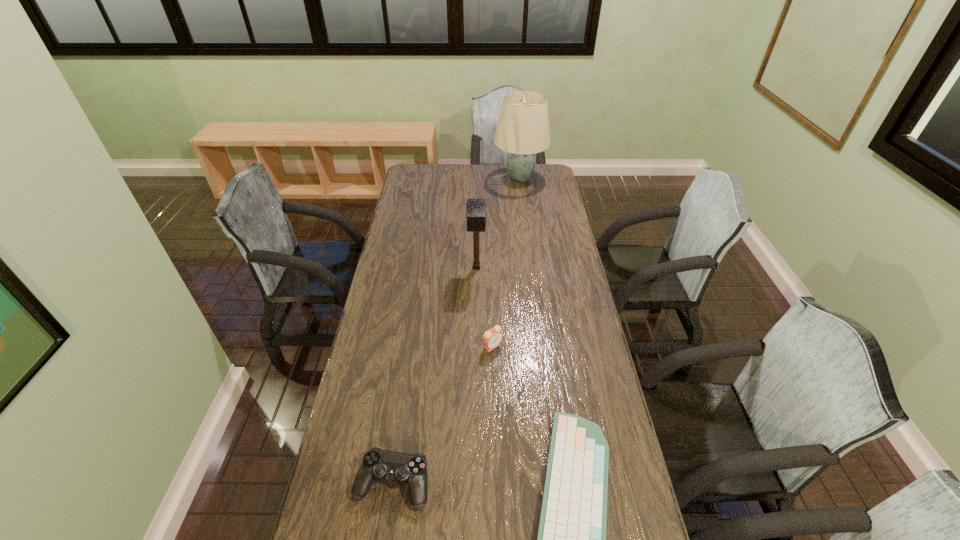
Where is `unoccupied area between the leftmost object and the third nearest object`? Image resolution: width=960 pixels, height=540 pixels. unoccupied area between the leftmost object and the third nearest object is located at coordinates (443, 415).

Where is `free space between the farthest object and the alarm clock`? free space between the farthest object and the alarm clock is located at coordinates (506, 262).

At what (x,y) coordinates should I click in order to perform the action: click on free spot between the leftmost object and the farthest object. Please return your answer as a coordinate pair (x, y). The image size is (960, 540). Looking at the image, I should click on (456, 332).

Identify the location of vacant space that's between the alarm clock and the mallet. (485, 307).

You are a GUI agent. You are given a task and a screenshot of the screen. Output one action in this format:
    pyautogui.click(x=<x>, y=<y>)
    Task: Click on the vacant area that lies between the leftmost object and the third farthest object
    
    Given the screenshot: What is the action you would take?
    pyautogui.click(x=443, y=415)

Identify which object is the third closest to the third farthest object. Please provide its 2D coordinates. Your answer should be formatted as a tuple, i.e. [(x, y)], where the tuple contains the x and y coordinates of a point satisfying the conditions above.

[(379, 465)]

The height and width of the screenshot is (540, 960). I want to click on object that stands as the third closest to the second tallest object, so click(x=571, y=539).

At what (x,y) coordinates should I click in order to perform the action: click on free spot that satisfies the following two spatial constraints: 1. on the back side of the tallest object; 2. on the left side of the mallet. Please return your answer as a coordinate pair (x, y). This screenshot has width=960, height=540. Looking at the image, I should click on (477, 179).